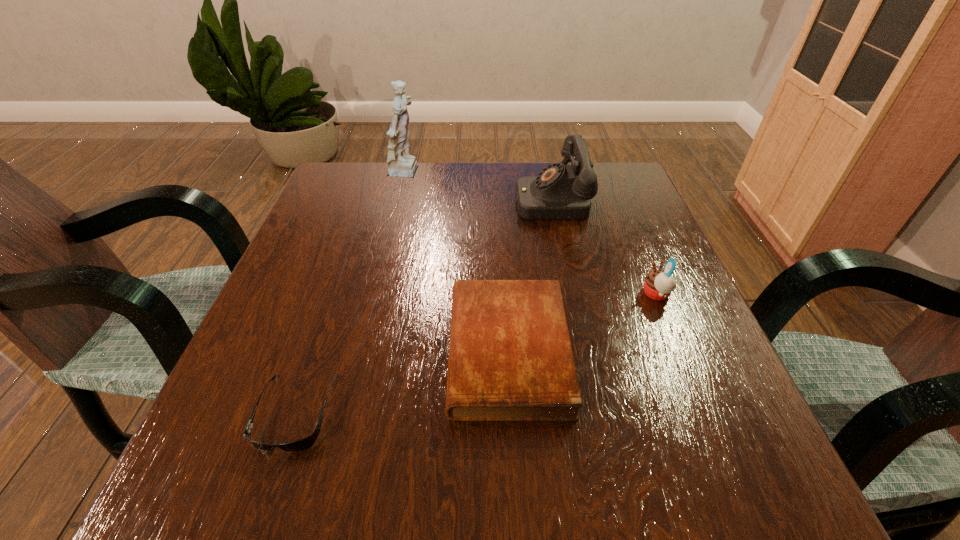
Locate which object is the third closest to the telephone. Please provide its 2D coordinates. Your answer should be formatted as a tuple, i.e. [(x, y)], where the tuple contains the x and y coordinates of a point satisfying the conditions above.

[(401, 164)]

Identify which object is the fourth closest to the telephone. Please provide its 2D coordinates. Your answer should be formatted as a tuple, i.e. [(x, y)], where the tuple contains the x and y coordinates of a point satisfying the conditions above.

[(305, 443)]

This screenshot has width=960, height=540. Find the location of `vacant region that satisfies the following two spatial constraints: 1. on the dial of the telephone; 2. on the front-facing side of the shortest object`. vacant region that satisfies the following two spatial constraints: 1. on the dial of the telephone; 2. on the front-facing side of the shortest object is located at coordinates (595, 412).

The height and width of the screenshot is (540, 960). What are the coordinates of `free space that satisfies the following two spatial constraints: 1. on the spine side of the second shortest object; 2. on the front-facing side of the shortest object` in the screenshot? It's located at (512, 412).

The width and height of the screenshot is (960, 540). In order to click on free space that satisfies the following two spatial constraints: 1. on the front-facing side of the figurine; 2. on the front-facing side of the sunglasses in this screenshot , I will do `click(350, 412)`.

Find the location of `vacant space that satisfies the following two spatial constraints: 1. on the front-facing side of the rightmost object; 2. on the front-facing side of the sunglasses`. vacant space that satisfies the following two spatial constraints: 1. on the front-facing side of the rightmost object; 2. on the front-facing side of the sunglasses is located at coordinates (705, 412).

This screenshot has width=960, height=540. I want to click on free spot that satisfies the following two spatial constraints: 1. on the front-facing side of the tallest object; 2. on the front-facing side of the sunglasses, so click(350, 412).

Locate an element on the screen. free location that satisfies the following two spatial constraints: 1. on the spine side of the second shortest object; 2. on the front-facing side of the sunglasses is located at coordinates (512, 412).